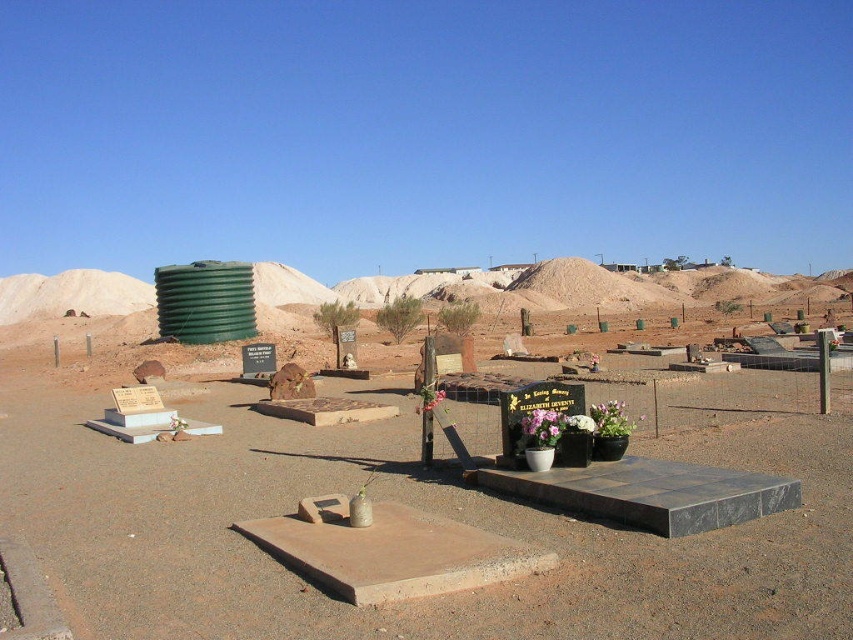
You are a gardener who wants to plant a new bush in the cemetery. You have a small green leafy bush at center and a purple fabric flower at center. Which one is shorter and better suited for a space where height is limited?

The purple fabric flower at center is not as tall as the green leafy bush at center, making it the better choice for a space with limited height.

You are a gardener tasked with watering plants in the cemetery. You have a watering can that can hold enough water to cover 7 meters. You see the green leafy shrub at center and the green leafy bush at center. Can you water both plants without needing to refill your watering can?

The distance between the green leafy shrub at center and the green leafy bush at center is 6.93 meters. Since your watering can can cover 7 meters, you can water both plants without needing to refill.